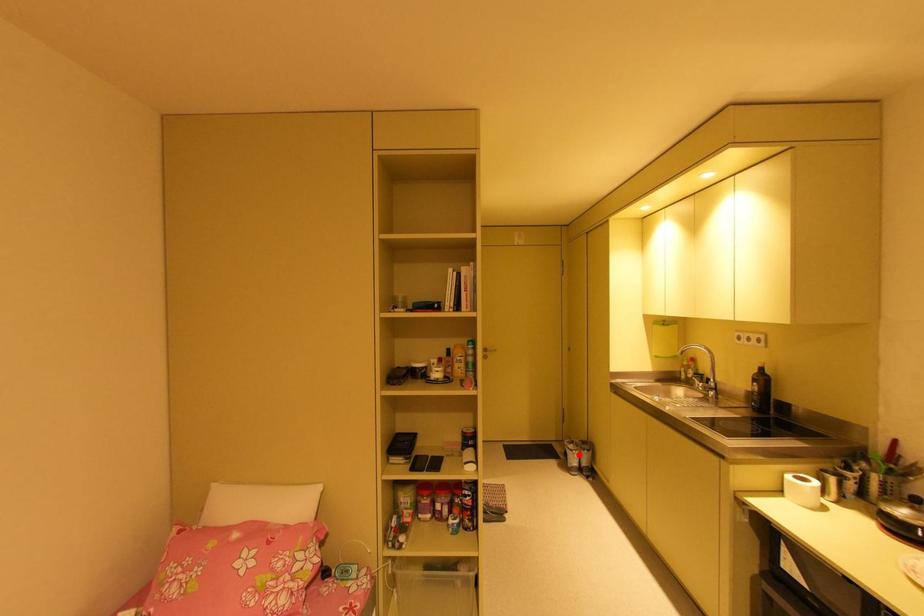
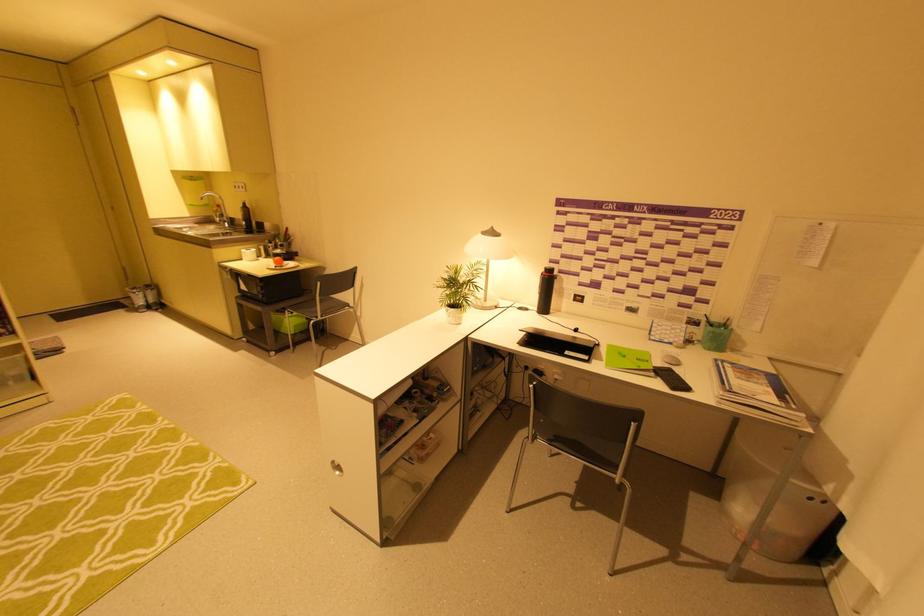
Question: I am providing you with two images of the same scene from different viewpoints. A red point is shown in image1. For the corresponding object point in image2, is it positioned nearer or farther from the camera?

Choices:
 (A) Nearer
 (B) Farther

Answer: (A)